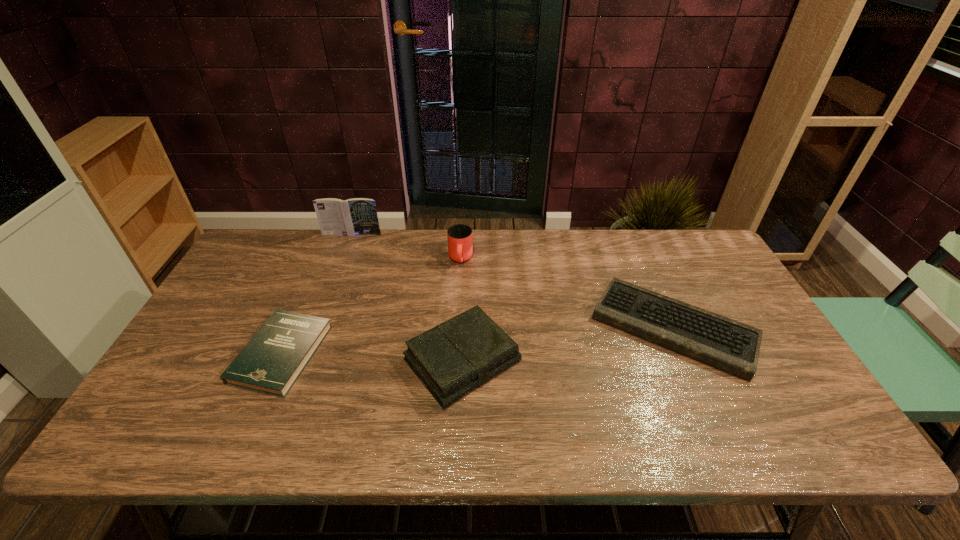
This screenshot has width=960, height=540. I want to click on vacant space situated on the handle side of the second tallest object, so click(459, 292).

Find the location of `free space located 0.310m on the left of the second tallest book`. free space located 0.310m on the left of the second tallest book is located at coordinates (283, 360).

Where is `vacant space situated 0.170m on the front of the computer keyboard`? The image size is (960, 540). vacant space situated 0.170m on the front of the computer keyboard is located at coordinates (728, 448).

Identify the location of vacant space located 0.090m on the front of the shortest book. The width and height of the screenshot is (960, 540). (248, 433).

The image size is (960, 540). In order to click on book positioned at the far edge in this screenshot , I will do `click(358, 216)`.

At what (x,y) coordinates should I click in order to perform the action: click on cup that is at the far edge. Please return your answer as a coordinate pair (x, y). Looking at the image, I should click on (460, 247).

Find the location of a particular element. object present at the left edge is located at coordinates (271, 362).

Find the location of a particular element. This screenshot has height=540, width=960. object situated at the right edge is located at coordinates coord(721,342).

The width and height of the screenshot is (960, 540). I want to click on blank space at the far edge, so click(488, 255).

The width and height of the screenshot is (960, 540). In the image, there is a desktop. Identify the location of free space at the near edge. [x=698, y=450].